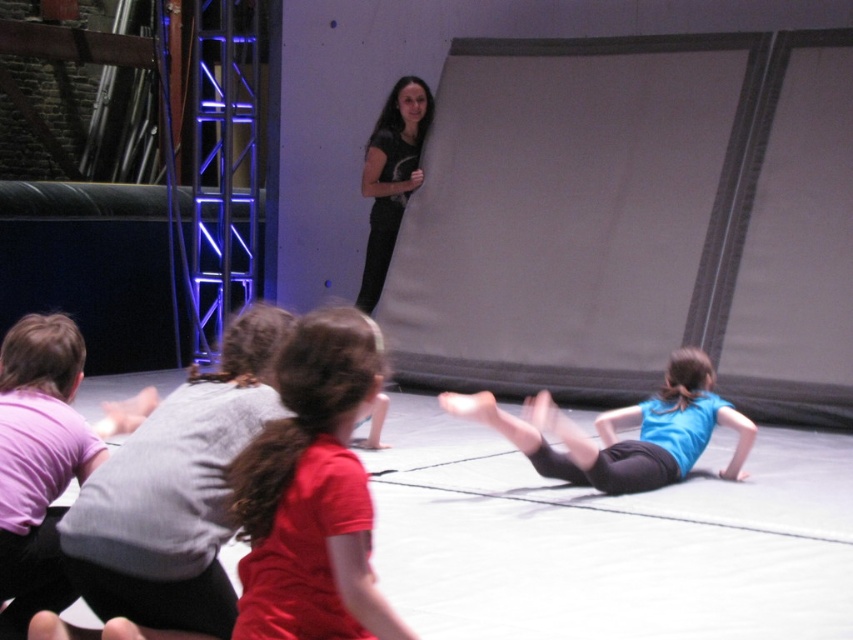
Question: Among these objects, which one is nearest to the camera?

Choices:
 (A) matte red shirt at center
 (B) blue matte shirt at lower right
 (C) matte black shirt at upper center

Answer: (A)

Question: Which point appears farthest from the camera in this image?

Choices:
 (A) (572, 468)
 (B) (213, 408)
 (C) (303, 616)
 (D) (390, 186)

Answer: (D)

Question: Is matte gray shirt at lower left positioned before matte red shirt at center?

Choices:
 (A) yes
 (B) no

Answer: (B)

Question: Is blue matte shirt at lower right to the left of matte black shirt at upper center from the viewer's perspective?

Choices:
 (A) yes
 (B) no

Answer: (B)

Question: Does matte gray shirt at lower left have a larger size compared to matte red shirt at center?

Choices:
 (A) no
 (B) yes

Answer: (B)

Question: Which object is the farthest from the matte gray shirt at lower left?

Choices:
 (A) blue matte shirt at lower right
 (B) matte red shirt at center
 (C) matte black shirt at upper center

Answer: (C)